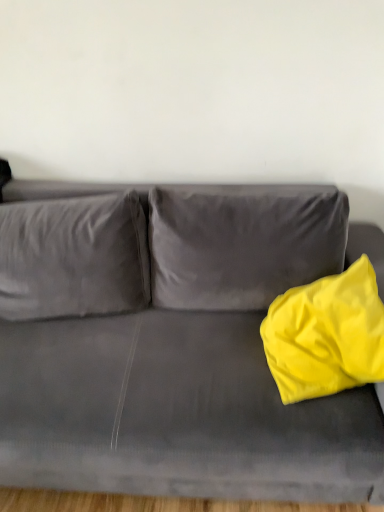
Question: Visually, is yellow fabric pillow at right positioned to the left or to the right of matte gray couch at center?

Choices:
 (A) right
 (B) left

Answer: (A)

Question: Is point (322, 359) positioned closer to the camera than point (379, 412)?

Choices:
 (A) farther
 (B) closer

Answer: (A)

Question: From their relative heights in the image, would you say yellow fabric pillow at right is taller or shorter than matte gray couch at center?

Choices:
 (A) tall
 (B) short

Answer: (B)

Question: Looking at the image, does matte gray couch at center seem bigger or smaller compared to yellow fabric pillow at right?

Choices:
 (A) big
 (B) small

Answer: (A)

Question: From the image's perspective, is matte gray couch at center positioned above or below yellow fabric pillow at right?

Choices:
 (A) above
 (B) below

Answer: (B)

Question: Based on their positions, is matte gray couch at center located to the left or right of yellow fabric pillow at right?

Choices:
 (A) right
 (B) left

Answer: (B)

Question: Considering the positions of matte gray couch at center and yellow fabric pillow at right in the image, is matte gray couch at center wider or thinner than yellow fabric pillow at right?

Choices:
 (A) thin
 (B) wide

Answer: (B)